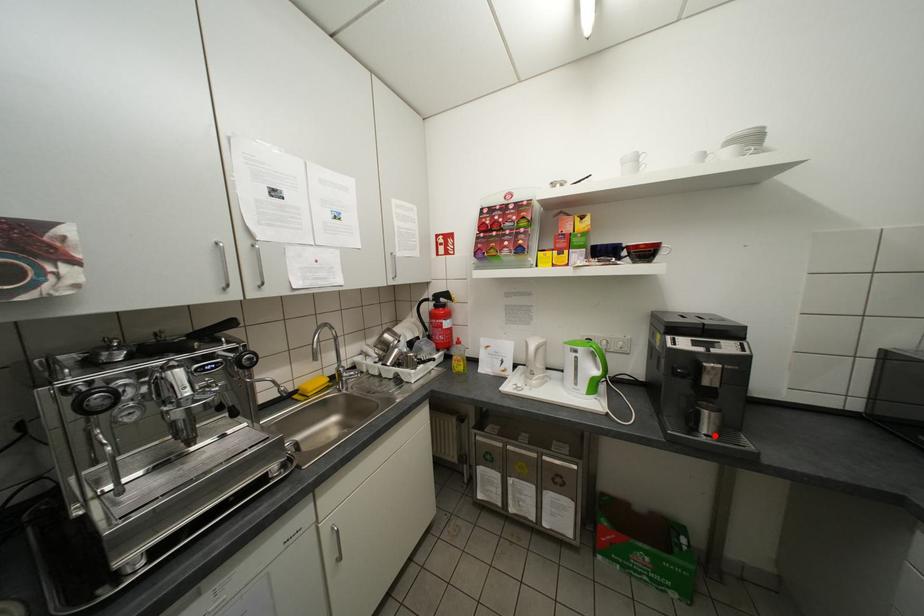
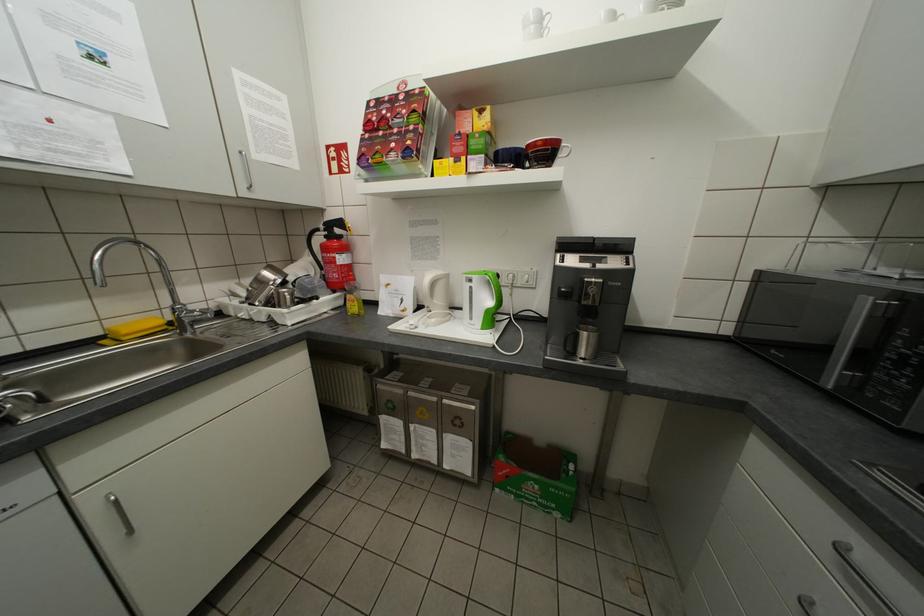
Find the pixel in the second image that matches the highlighted location in the first image.

(590, 359)